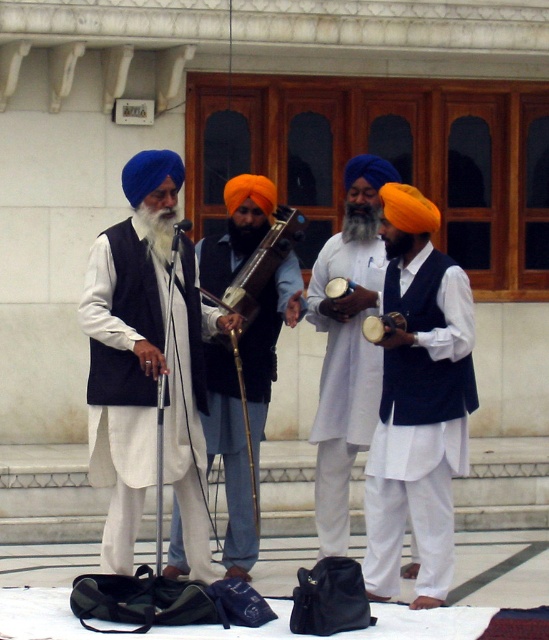
You are a photographer at the event and want to capture a photo where the white cotton drum at center and the wooden polished instrument at center are both visible. Based on their positions, which object should be placed on the right side of the photo?

The white cotton drum at center should be placed on the right side of the photo because it is to the right of the wooden polished instrument at center according to the description.

You are a photographer trying to capture the entire group of performers in one shot. You notice the matte black vest at center and the wooden polished instrument at center. Which one is wider so that you can adjust your camera angle accordingly?

The matte black vest at center is wider than the wooden polished instrument at center, so you should adjust your camera angle to accommodate its width.

You are a performer standing at the edge of the stage, and you need to reach both the matte black vest at center and the white cotton drum at center during your performance. Considering the space between them, can you easily move between these two items without needing to take large steps?

The distance between the matte black vest at center and the white cotton drum at center is 3.86 feet. This distance is manageable for a performer to move between them without needing to take large steps.